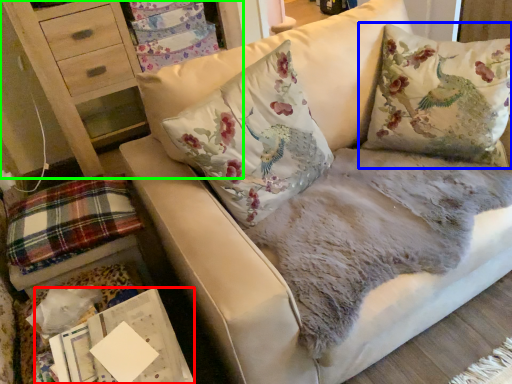
Question: Considering the real-world distances, which object is closest to magazine (highlighted by a red box)? pillow (highlighted by a blue box) or furniture (highlighted by a green box).

Choices:
 (A) pillow
 (B) furniture

Answer: (A)